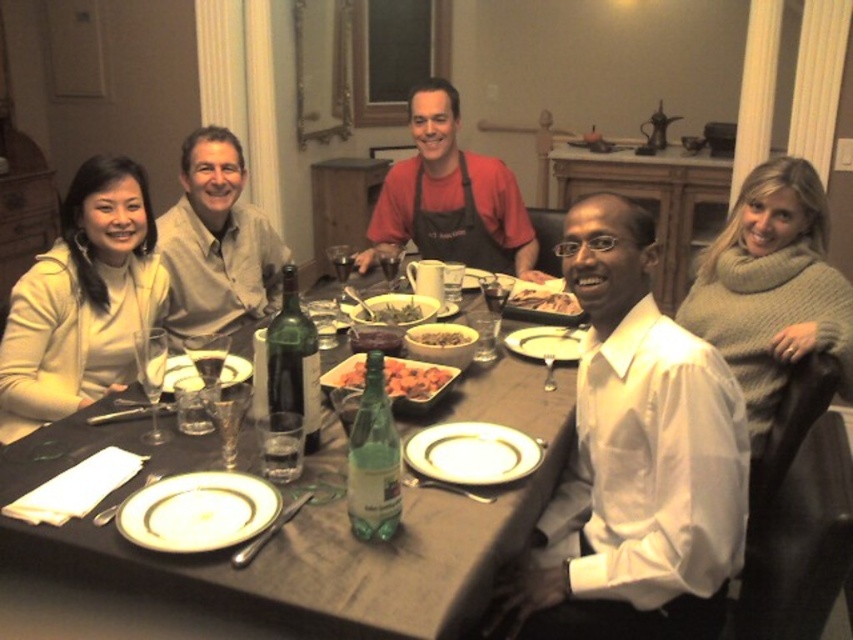
Based on the photo, please look at the dining table scene. There are five people seated around the table, and you notice a point marked at coordinates (82,300). What object is located at this point?

The point at coordinates (82,300) marks the white matte sweater at lower left.

You are a server at a restaurant and need to place a new dish on the table. The dish requires placing it exactly between the green glass platter at center and the brown matte rice bowl at center. How far apart should you position them?

The green glass platter at center is 18.80 inches away from the brown matte rice bowl at center, so you should position them 18.80 inches apart.